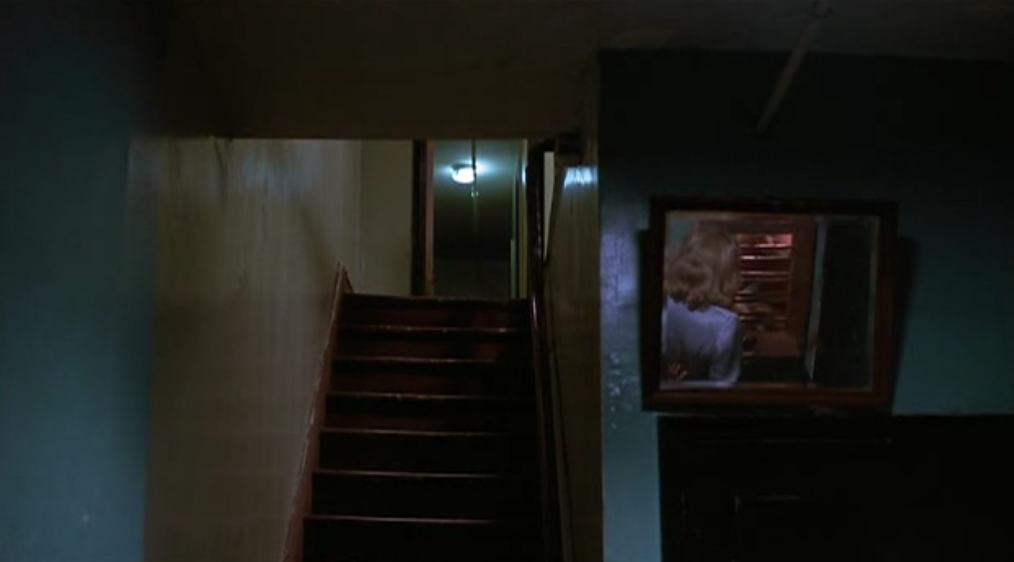
Find the location of `banister`. banister is located at coordinates (544, 379).